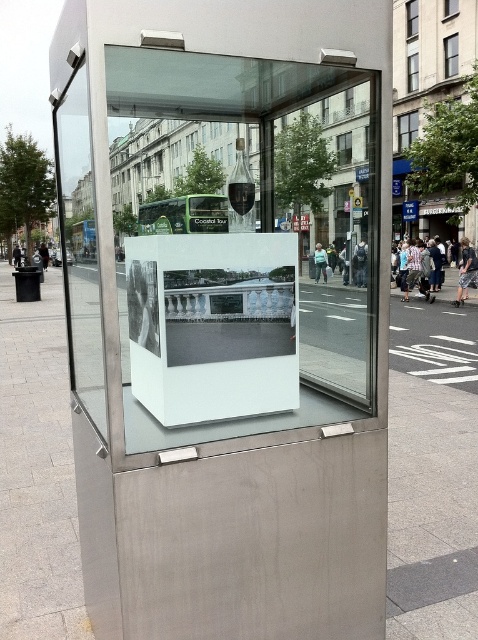
Which of these two, brushed metal pavement at center or white glossy photo frame at center, stands taller?

brushed metal pavement at center is taller.

Does point (9, 484) come in front of point (201, 326)?

No, (9, 484) is further to viewer.

I want to click on brushed metal pavement at center, so click(x=36, y=472).

From the picture: Is brushed metal pavement at center to the right of transparent glass door at left from the viewer's perspective?

Yes, brushed metal pavement at center is to the right of transparent glass door at left.

Can you confirm if brushed metal pavement at center is shorter than transparent glass door at left?

Yes.

This screenshot has width=478, height=640. Describe the element at coordinates (36, 472) in the screenshot. I see `brushed metal pavement at center` at that location.

Identify the location of brushed metal pavement at center. (36, 472).

Does white glossy photo frame at center appear over transparent glass door at left?

Incorrect, white glossy photo frame at center is not positioned above transparent glass door at left.

Is the position of white glossy photo frame at center less distant than that of transparent glass door at left?

No.

Does point (294, 305) lie behind point (83, 115)?

No, it is in front of (83, 115).

Find the location of a particular element. This screenshot has height=640, width=478. white glossy photo frame at center is located at coordinates (213, 324).